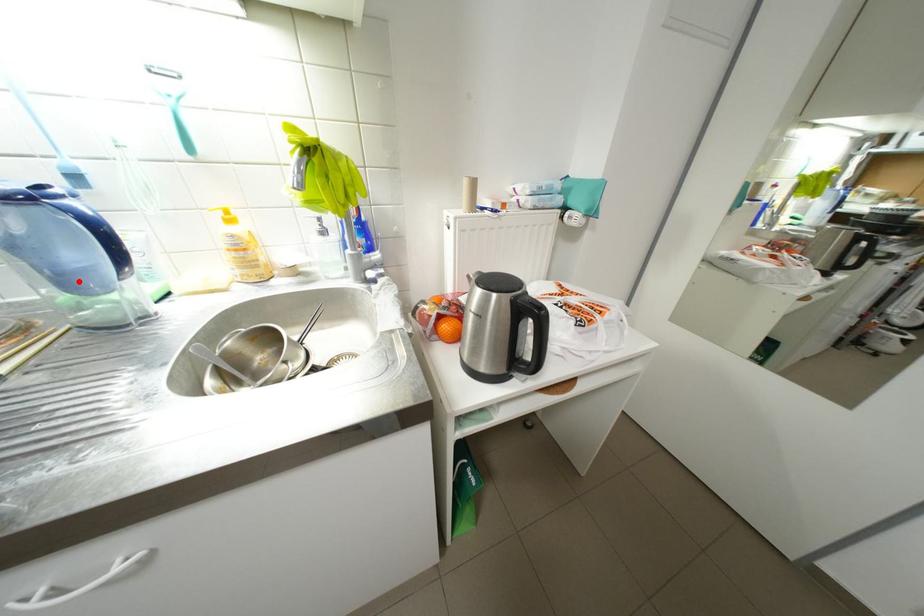
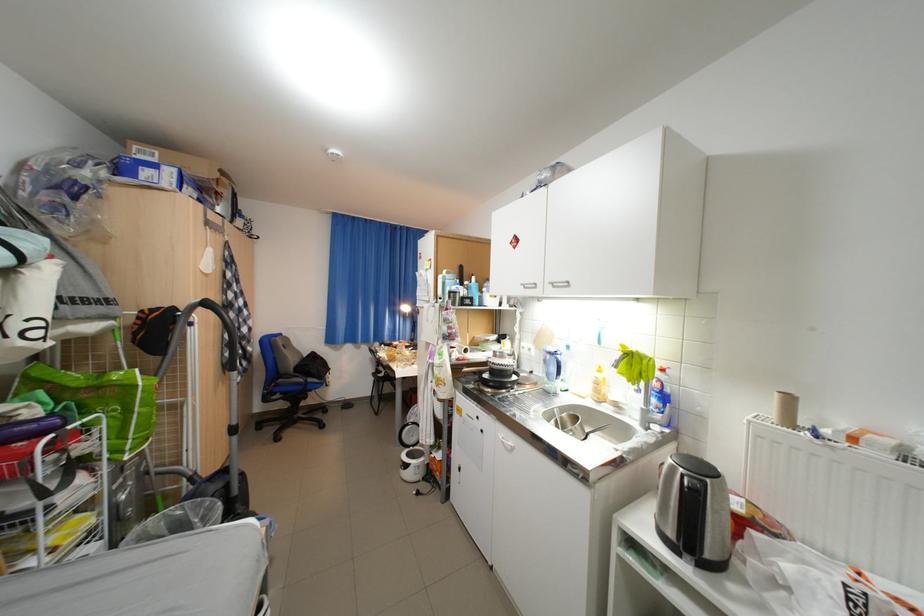
Locate, in the second image, the point that corresponds to the highlighted location in the first image.

(560, 376)